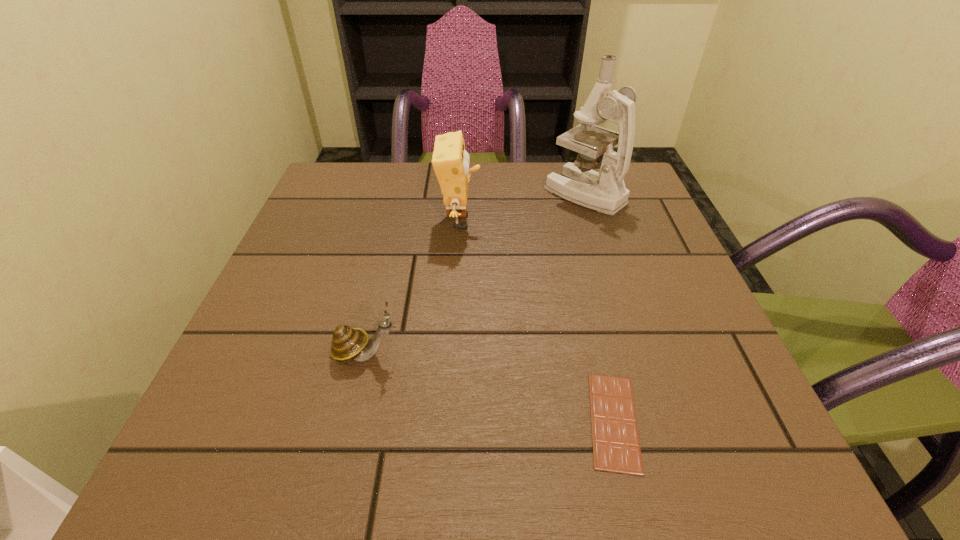
Find the location of `microscope`. microscope is located at coordinates (605, 192).

Locate an element on the screen. This screenshot has height=540, width=960. sponge is located at coordinates (450, 160).

Locate an element on the screen. the third object from right to left is located at coordinates (450, 160).

You are a GUI agent. You are given a task and a screenshot of the screen. Output one action in this format:
    pyautogui.click(x=<x>, y=<y>)
    Task: Click on the leftmost object
    
    Given the screenshot: What is the action you would take?
    pyautogui.click(x=348, y=344)

Where is `snail`? snail is located at coordinates (348, 344).

Find the location of `the nearest object`. the nearest object is located at coordinates pos(616,448).

Locate an element on the screen. This screenshot has height=540, width=960. chocolate bar is located at coordinates (616, 448).

Find the location of a particular element. vacant region located 0.290m on the front of the tallest object is located at coordinates (621, 310).

Locate an element on the screen. This screenshot has height=540, width=960. vacant region located on the face of the sponge is located at coordinates (642, 222).

The height and width of the screenshot is (540, 960). Find the location of `vacant space situated on the face of the second shortest object`. vacant space situated on the face of the second shortest object is located at coordinates (x=616, y=354).